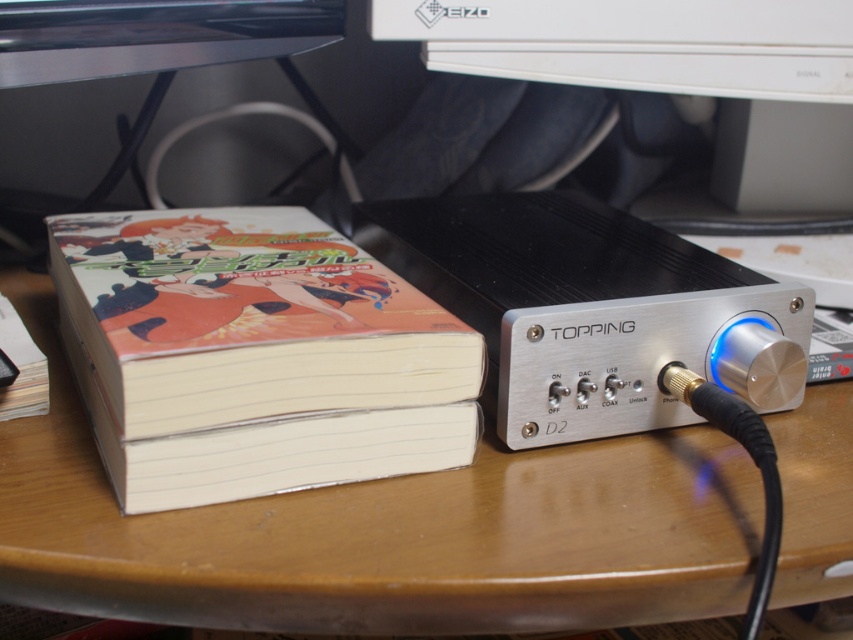
Question: Estimate the real-world distances between objects in this image. Which object is closer to the wooden at center?

Choices:
 (A) white plastic monitor at upper center
 (B) matte paperback book at left

Answer: (B)

Question: Which of these objects is positioned closest to the wooden at center?

Choices:
 (A) white plastic monitor at upper center
 (B) matte paperback book at left

Answer: (B)

Question: Which of the following is the closest to the observer?

Choices:
 (A) (138, 289)
 (B) (311, 593)

Answer: (B)

Question: Considering the relative positions of matte paperback book at left and white plastic monitor at upper center in the image provided, where is matte paperback book at left located with respect to white plastic monitor at upper center?

Choices:
 (A) right
 (B) left

Answer: (B)

Question: Considering the relative positions of matte paperback book at left and white plastic monitor at upper center in the image provided, where is matte paperback book at left located with respect to white plastic monitor at upper center?

Choices:
 (A) below
 (B) above

Answer: (A)

Question: Does matte paperback book at left appear on the left side of white plastic monitor at upper center?

Choices:
 (A) yes
 (B) no

Answer: (A)